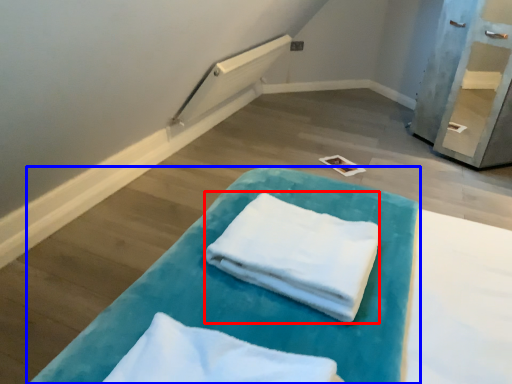
Question: Which of the following is the farthest to the observer, cloth (highlighted by a red box) or furniture (highlighted by a blue box)?

Choices:
 (A) cloth
 (B) furniture

Answer: (A)